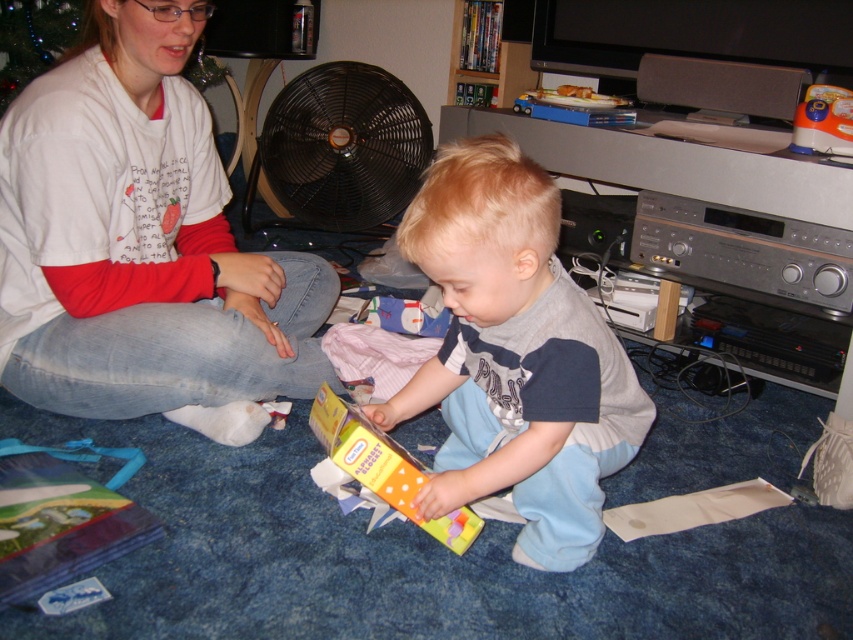
Which is below, white cotton shirt at upper left or orange plastic toy at upper right?

white cotton shirt at upper left is lower down.

Is white cotton shirt at upper left further to camera compared to orange plastic toy at upper right?

That is False.

Is point (3, 346) farther from viewer compared to point (828, 115)?

No, it is in front of (828, 115).

Where is `white cotton shirt at upper left`? white cotton shirt at upper left is located at coordinates (141, 244).

Can you confirm if black plastic fan at upper center is smaller than yellow paper at center?

No, black plastic fan at upper center is not smaller than yellow paper at center.

Measure the distance between point (378, 81) and camera.

Point (378, 81) and camera are 9.28 feet apart from each other.

Measure the distance between black plastic fan at upper center and camera.

They are 9.17 feet apart.

Locate an element on the screen. The height and width of the screenshot is (640, 853). black plastic fan at upper center is located at coordinates point(341,148).

Is point (569, 300) farther from camera compared to point (318, 168)?

No, it is in front of (318, 168).

Which is behind, point (550, 196) or point (271, 154)?

Point (271, 154)

Is point (427, 232) positioned before point (343, 173)?

Yes, point (427, 232) is in front of point (343, 173).

Find the location of a particular element. The height and width of the screenshot is (640, 853). orange polka dot book at center is located at coordinates (514, 356).